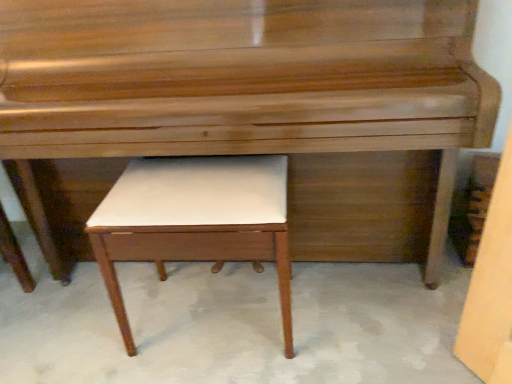
Question: Is white leather stool at center bigger or smaller than glossy wood piano at center?

Choices:
 (A) small
 (B) big

Answer: (A)

Question: Is point (210, 168) closer or farther from the camera than point (422, 125)?

Choices:
 (A) farther
 (B) closer

Answer: (A)

Question: Is white leather stool at center in front of or behind glossy wood piano at center in the image?

Choices:
 (A) front
 (B) behind

Answer: (B)

Question: Do you think glossy wood piano at center is within white leather stool at center, or outside of it?

Choices:
 (A) inside
 (B) outside

Answer: (B)

Question: Considering the relative positions of glossy wood piano at center and white leather stool at center in the image provided, is glossy wood piano at center to the left or to the right of white leather stool at center?

Choices:
 (A) right
 (B) left

Answer: (A)

Question: Based on their sizes in the image, would you say glossy wood piano at center is bigger or smaller than white leather stool at center?

Choices:
 (A) small
 (B) big

Answer: (B)

Question: From the image's perspective, is glossy wood piano at center located above or below white leather stool at center?

Choices:
 (A) below
 (B) above

Answer: (B)